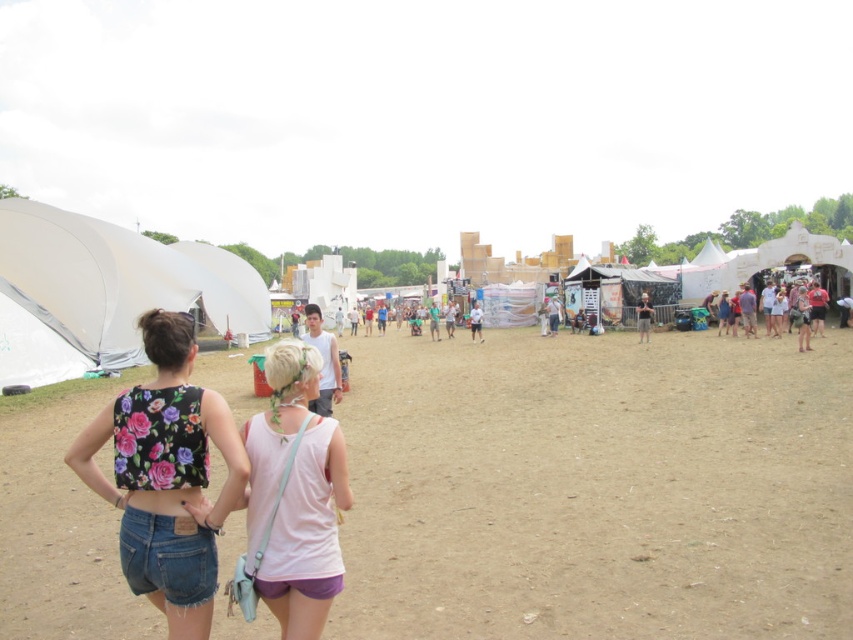
Question: Which of the following is the farthest from the observer?

Choices:
 (A) floral fabric crop top at lower left
 (B) white matte tent at left
 (C) brown sandy dirt field at center
 (D) denim shorts at lower left

Answer: (B)

Question: Does brown sandy dirt field at center appear under denim shorts at lower left?

Choices:
 (A) no
 (B) yes

Answer: (B)

Question: Can you confirm if brown sandy dirt field at center is positioned below floral fabric crop top at lower left?

Choices:
 (A) no
 (B) yes

Answer: (B)

Question: Is floral fabric crop top at lower left to the right of white matte tent at left from the viewer's perspective?

Choices:
 (A) yes
 (B) no

Answer: (A)

Question: Which of the following is the farthest from the observer?

Choices:
 (A) (222, 362)
 (B) (209, 576)

Answer: (A)

Question: Among these points, which one is farthest from the camera?

Choices:
 (A) [282, 465]
 (B) [631, 481]
 (C) [45, 211]
 (D) [229, 458]

Answer: (C)